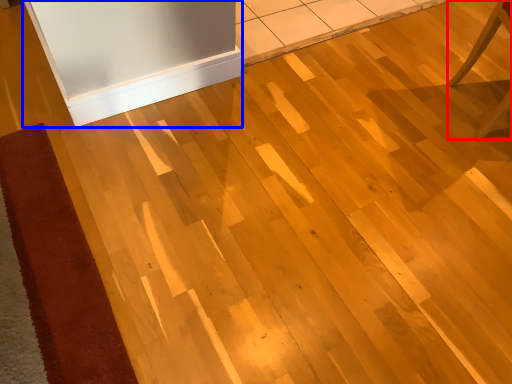
Question: Which object is further to the camera taking this photo, furniture (highlighted by a red box) or fridge (highlighted by a blue box)?

Choices:
 (A) furniture
 (B) fridge

Answer: (B)